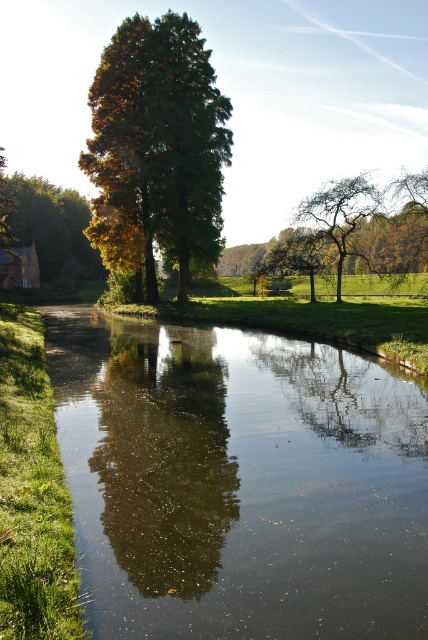
Question: Which object appears closest to the camera in this image?

Choices:
 (A) smooth reflective water at center
 (B) green matte tree at center
 (C) green matte tree at upper center

Answer: (A)

Question: Observing the image, what is the correct spatial positioning of green matte tree at center in reference to green matte tree at upper center?

Choices:
 (A) below
 (B) above

Answer: (A)

Question: Estimate the real-world distances between objects in this image. Which object is farther from the green matte tree at center?

Choices:
 (A) green matte tree at upper center
 (B) smooth reflective water at center

Answer: (B)

Question: Which point appears closest to the camera in this image?

Choices:
 (A) (151, 204)
 (B) (284, 636)
 (C) (303, 205)

Answer: (B)

Question: Does smooth reflective water at center appear over green matte tree at center?

Choices:
 (A) no
 (B) yes

Answer: (A)

Question: Does smooth reflective water at center have a greater width compared to green matte tree at center?

Choices:
 (A) yes
 (B) no

Answer: (B)